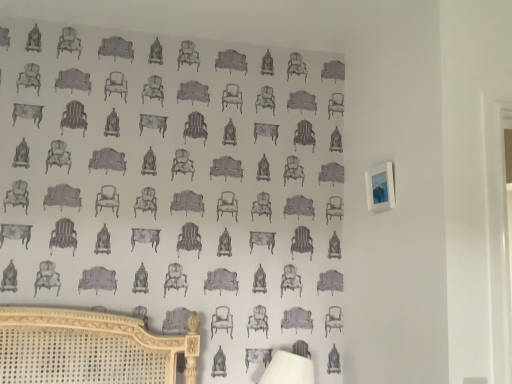
What do you see at coordinates (288, 369) in the screenshot?
I see `white fabric table lamp at lower center` at bounding box center [288, 369].

Locate an element on the screen. white fabric table lamp at lower center is located at coordinates (288, 369).

Measure the distance between point (381, 169) and camera.

1.74 meters.

What do you see at coordinates (380, 188) in the screenshot? I see `blue glossy picture frame at upper right` at bounding box center [380, 188].

Identify the location of blue glossy picture frame at upper right. The image size is (512, 384). (380, 188).

You are a GUI agent. You are given a task and a screenshot of the screen. Output one action in this format:
    pyautogui.click(x=<x>, y=<y>)
    Task: Click on the white fabric table lamp at lower center
    This screenshot has height=384, width=512.
    Given the screenshot: What is the action you would take?
    pyautogui.click(x=288, y=369)

Based on their positions, is white fabric table lamp at lower center located to the left or right of blue glossy picture frame at upper right?

white fabric table lamp at lower center is positioned on blue glossy picture frame at upper right's left side.

Is white fabric table lamp at lower center positioned behind blue glossy picture frame at upper right?

Yes, white fabric table lamp at lower center is further from the viewer.

Does point (286, 368) appear closer or farther from the camera than point (376, 168)?

Point (286, 368) is closer to the camera than point (376, 168).

From the image's perspective, is white fabric table lamp at lower center positioned above or below blue glossy picture frame at upper right?

Clearly, from the image's perspective, white fabric table lamp at lower center is below blue glossy picture frame at upper right.

From a real-world perspective, does white fabric table lamp at lower center sit lower than blue glossy picture frame at upper right?

Yes, from a real-world perspective, white fabric table lamp at lower center is under blue glossy picture frame at upper right.

Does white fabric table lamp at lower center have a greater width compared to blue glossy picture frame at upper right?

Correct, the width of white fabric table lamp at lower center exceeds that of blue glossy picture frame at upper right.

Is white fabric table lamp at lower center shorter than blue glossy picture frame at upper right?

Incorrect, the height of white fabric table lamp at lower center does not fall short of that of blue glossy picture frame at upper right.

Is white fabric table lamp at lower center smaller than blue glossy picture frame at upper right?

No, white fabric table lamp at lower center is not smaller than blue glossy picture frame at upper right.

From the picture: Is white fabric table lamp at lower center positioned beyond the bounds of blue glossy picture frame at upper right?

Yes, white fabric table lamp at lower center is located beyond the bounds of blue glossy picture frame at upper right.

Is white fabric table lamp at lower center in contact with blue glossy picture frame at upper right?

There is a gap between white fabric table lamp at lower center and blue glossy picture frame at upper right.

Is white fabric table lamp at lower center facing towards blue glossy picture frame at upper right?

No, white fabric table lamp at lower center does not turn towards blue glossy picture frame at upper right.

What's the angular difference between white fabric table lamp at lower center and blue glossy picture frame at upper right's facing directions?

82.3 degrees separate the facing orientations of white fabric table lamp at lower center and blue glossy picture frame at upper right.

Locate an element on the screen. picture frame on the right of white fabric table lamp at lower center is located at coordinates (380, 188).

Is blue glossy picture frame at upper right at the right side of white fabric table lamp at lower center?

Correct, you'll find blue glossy picture frame at upper right to the right of white fabric table lamp at lower center.

Does blue glossy picture frame at upper right come in front of white fabric table lamp at lower center?

Yes, the depth of blue glossy picture frame at upper right is less than that of white fabric table lamp at lower center.

Considering the points (367, 202) and (311, 363), which point is in front, point (367, 202) or point (311, 363)?

Positioned in front is point (311, 363).

From the image's perspective, would you say blue glossy picture frame at upper right is positioned over white fabric table lamp at lower center?

Indeed, from the image's perspective, blue glossy picture frame at upper right is shown above white fabric table lamp at lower center.

From a real-world perspective, is blue glossy picture frame at upper right under white fabric table lamp at lower center?

No, from a real-world perspective, blue glossy picture frame at upper right is not under white fabric table lamp at lower center.

Is blue glossy picture frame at upper right thinner than white fabric table lamp at lower center?

Indeed, blue glossy picture frame at upper right has a lesser width compared to white fabric table lamp at lower center.

Can you confirm if blue glossy picture frame at upper right is taller than white fabric table lamp at lower center?

In fact, blue glossy picture frame at upper right may be shorter than white fabric table lamp at lower center.

Is blue glossy picture frame at upper right bigger than white fabric table lamp at lower center?

No.

Would you say blue glossy picture frame at upper right is outside white fabric table lamp at lower center?

blue glossy picture frame at upper right is positioned outside white fabric table lamp at lower center.

Is blue glossy picture frame at upper right far from white fabric table lamp at lower center?

Actually, blue glossy picture frame at upper right and white fabric table lamp at lower center are a little close together.

Could you tell me if blue glossy picture frame at upper right is turned towards white fabric table lamp at lower center?

No, blue glossy picture frame at upper right is not oriented towards white fabric table lamp at lower center.

How many degrees apart are the facing directions of blue glossy picture frame at upper right and white fabric table lamp at lower center?

82.3 degrees separate the facing orientations of blue glossy picture frame at upper right and white fabric table lamp at lower center.

Find the location of a particular element. Image resolution: width=512 pixels, height=384 pixels. picture frame in front of the white fabric table lamp at lower center is located at coordinates (380, 188).

Find the location of a particular element. The image size is (512, 384). picture frame on the right of the white fabric table lamp at lower center is located at coordinates coord(380,188).

You are a GUI agent. You are given a task and a screenshot of the screen. Output one action in this format:
    pyautogui.click(x=<x>, y=<y>)
    Task: Click on the table lamp to the left of blue glossy picture frame at upper right
    The height and width of the screenshot is (384, 512).
    Given the screenshot: What is the action you would take?
    pyautogui.click(x=288, y=369)